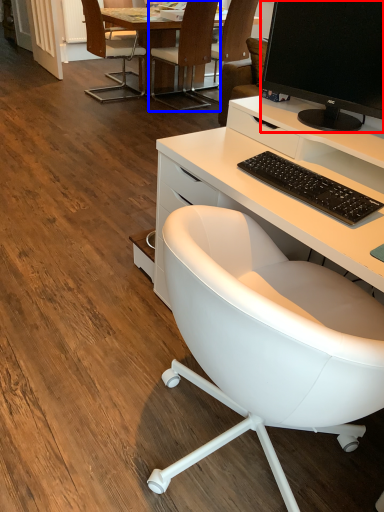
Question: Which object appears closest to the camera in this image, television (highlighted by a red box) or chair (highlighted by a blue box)?

Choices:
 (A) television
 (B) chair

Answer: (A)